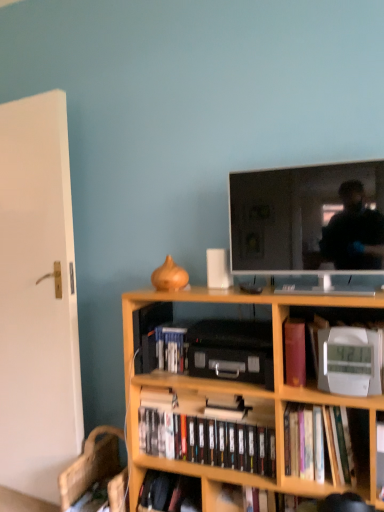
Question: From a real-world perspective, relative to wooden computer chair at lower left, is flat screen tv at upper center vertically above or below?

Choices:
 (A) below
 (B) above

Answer: (B)

Question: Is flat screen tv at upper center wider or thinner than wooden computer chair at lower left?

Choices:
 (A) thin
 (B) wide

Answer: (A)

Question: Estimate the real-world distances between objects in this image. Which object is closer to the flat screen tv at upper center?

Choices:
 (A) wooden computer chair at lower left
 (B) hardcover book at center
 (C) purple matte bookshelf at center, the fourth book positioned from the bottom
 (D) black matte dvds at center, marked as the 2th book in a bottom-to-top arrangement
 (E) white glossy book at center, the 3th book from the top

Answer: (C)

Question: Estimate the real-world distances between objects in this image. Which object is farther from the purple matte bookshelf at center, positioned as the second book in top-to-bottom order?

Choices:
 (A) white plastic clock at lower right, arranged as the 1th book when viewed from the top
 (B) hardcover book at center
 (C) wooden bookcase at center
 (D) wooden computer chair at lower left
 (E) flat screen tv at upper center

Answer: (D)